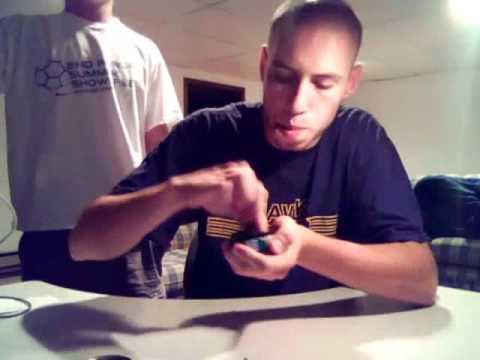
Where is `white ceiling tile`? The height and width of the screenshot is (360, 480). white ceiling tile is located at coordinates (227, 40).